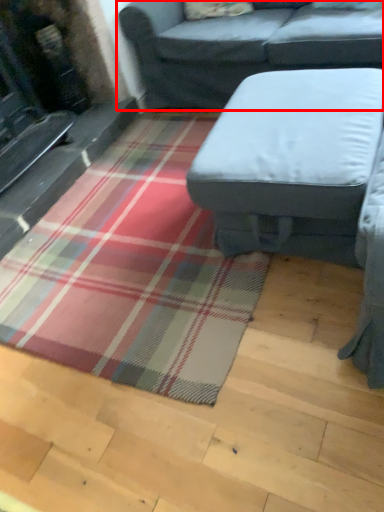
Question: From the image's perspective, where is studio couch (annotated by the red box) located in relation to studio couch in the image?

Choices:
 (A) below
 (B) above

Answer: (B)